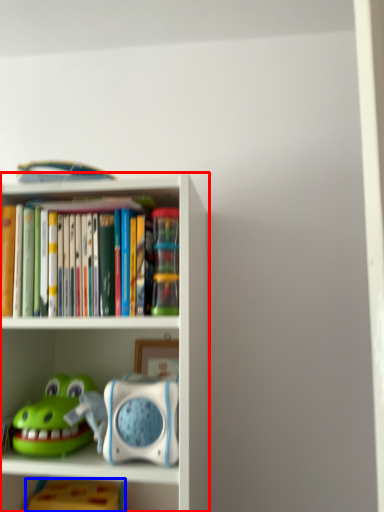
Question: Among these objects, which one is farthest to the camera, shelf (highlighted by a red box) or toy (highlighted by a blue box)?

Choices:
 (A) shelf
 (B) toy

Answer: (B)